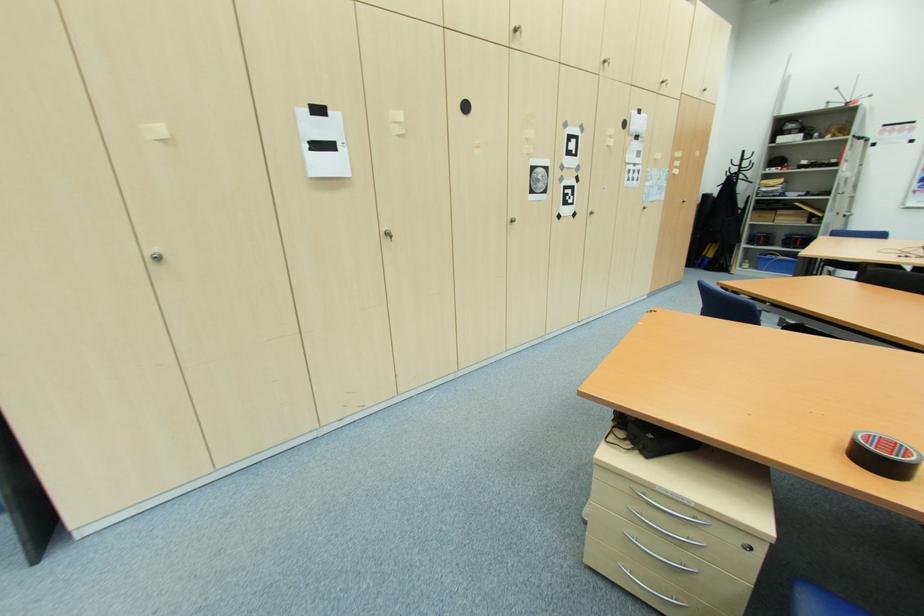
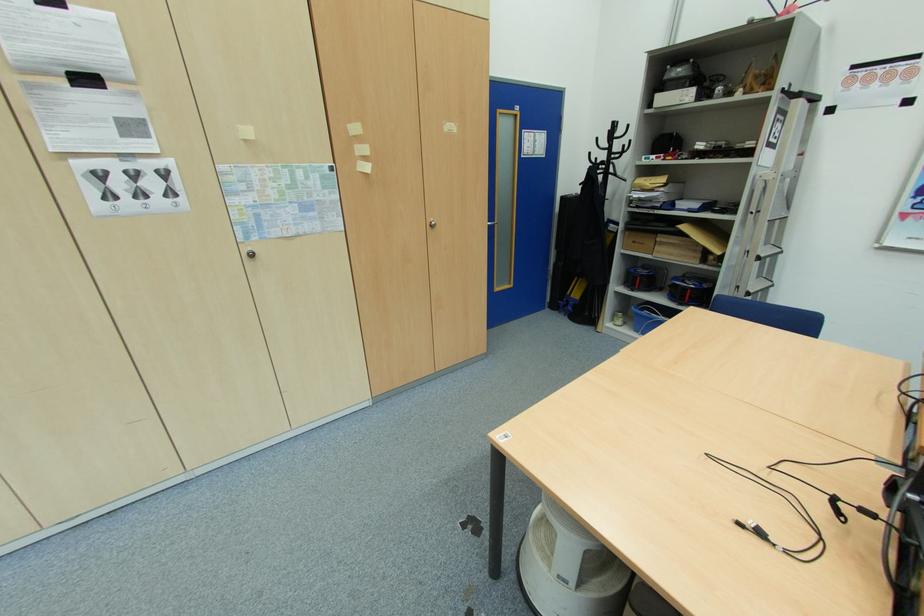
Find the pixel in the second image that matches (x=748, y=159) in the first image.

(619, 136)